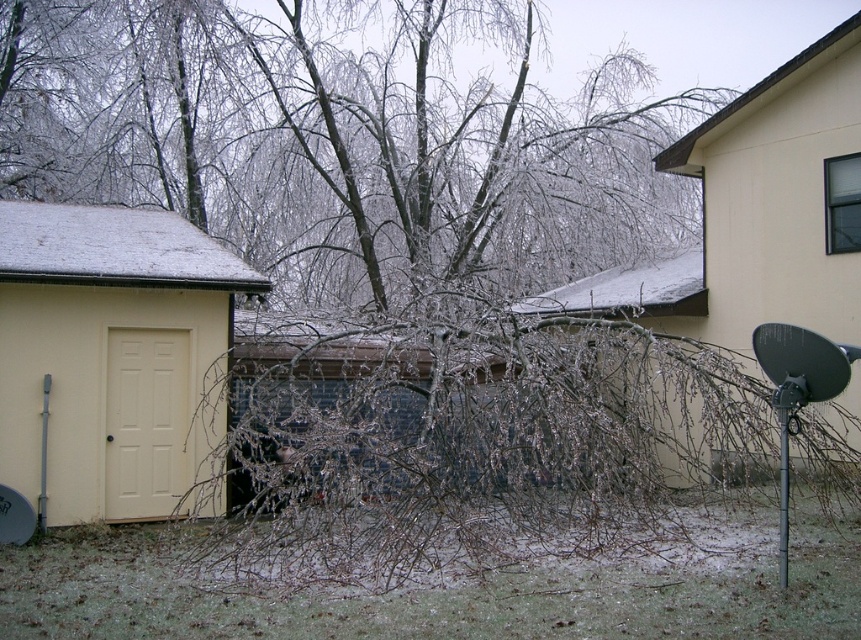
Is frosted branches at center above yellow matte door at left?

Actually, frosted branches at center is below yellow matte door at left.

Image resolution: width=861 pixels, height=640 pixels. I want to click on frosted branches at center, so click(451, 593).

At what (x,y) coordinates should I click in order to perform the action: click on frosted branches at center. Please return your answer as a coordinate pair (x, y). This screenshot has width=861, height=640. Looking at the image, I should click on click(x=451, y=593).

Is frozen wood branches at center shorter than frosted branches at center?

In fact, frozen wood branches at center may be taller than frosted branches at center.

Is point (528, 410) closer to viewer compared to point (393, 608)?

No.

What are the coordinates of `frozen wood branches at center` in the screenshot? It's located at (505, 440).

Does frozen wood branches at center have a lesser height compared to yellow matte door at left?

Indeed, frozen wood branches at center has a lesser height compared to yellow matte door at left.

Which of these two, frozen wood branches at center or yellow matte door at left, stands shorter?

With less height is frozen wood branches at center.

Is point (240, 429) closer to viewer compared to point (194, 458)?

Yes, point (240, 429) is in front of point (194, 458).

Identify the location of frozen wood branches at center. point(505,440).